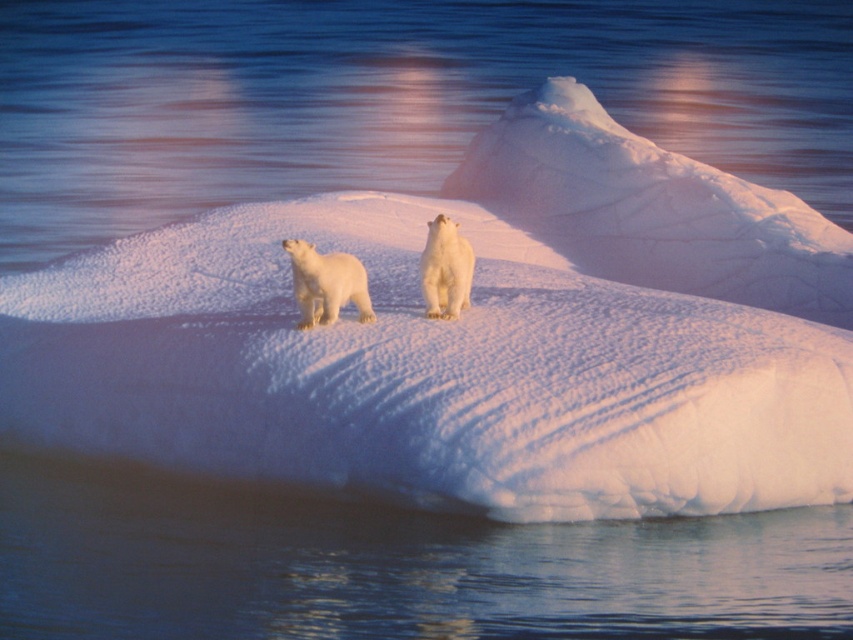
Question: Which object is closer to the camera taking this photo?

Choices:
 (A) white fur bear at center
 (B) white fur polar bear at left

Answer: (B)

Question: Does white fur polar bear at left have a smaller size compared to white fur bear at center?

Choices:
 (A) yes
 (B) no

Answer: (B)

Question: Is white fur polar bear at left further to the viewer compared to white fur bear at center?

Choices:
 (A) no
 (B) yes

Answer: (A)

Question: Is the position of white fur polar bear at left more distant than that of white fur bear at center?

Choices:
 (A) yes
 (B) no

Answer: (B)